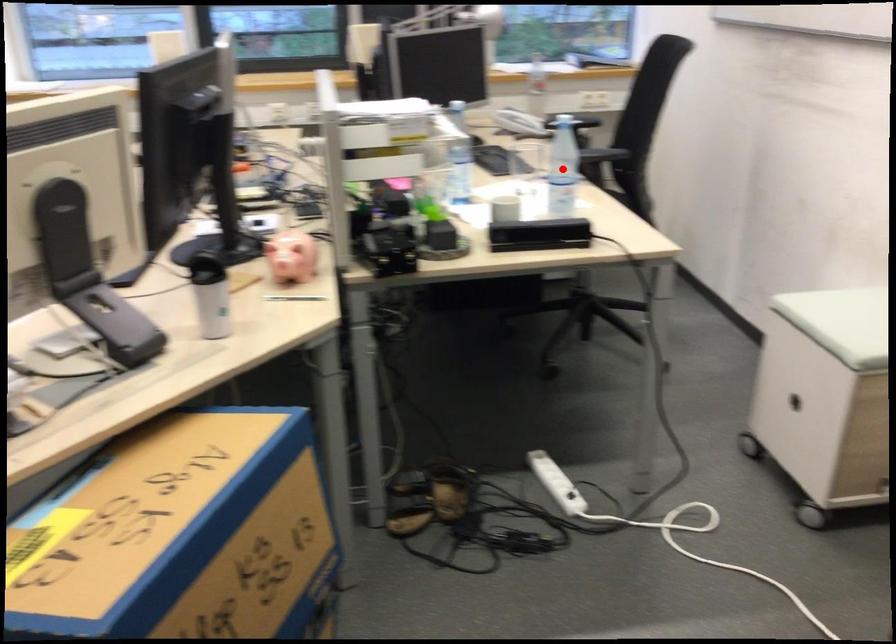
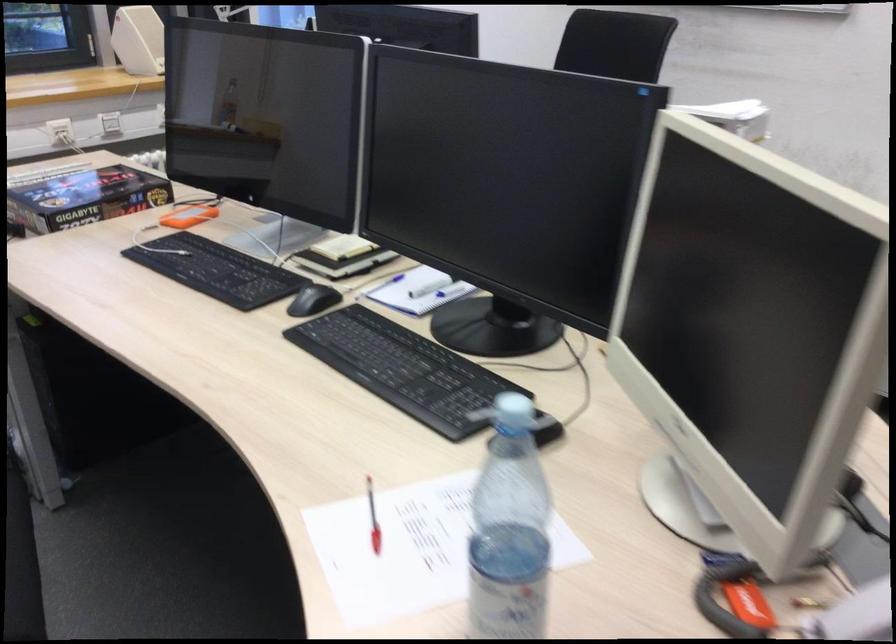
Question: I am providing you with two images of the same scene from different viewpoints. A red point is marked on the first image. Can you still see the location of the red point in image 2?

Choices:
 (A) Yes
 (B) No

Answer: (B)